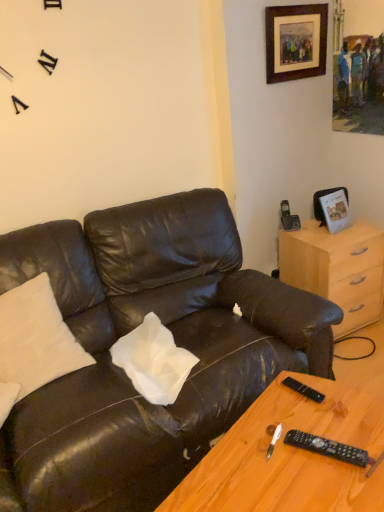
Question: Is wooden framed artwork at upper right, the second picture frame in the bottom-to-top sequence, smaller than black plastic remote at lower right, which is the first remote in top-to-bottom order?

Choices:
 (A) no
 (B) yes

Answer: (A)

Question: Would you say wooden framed artwork at upper right, the 1th picture frame in the top-to-bottom sequence, is outside black plastic remote at lower right, which is the first remote in top-to-bottom order?

Choices:
 (A) yes
 (B) no

Answer: (A)

Question: From the image's perspective, does wooden framed artwork at upper right, the second picture frame in the bottom-to-top sequence, appear lower than black plastic remote at lower right, positioned as the 2th remote in bottom-to-top order?

Choices:
 (A) yes
 (B) no

Answer: (B)

Question: Can you see wooden framed artwork at upper right, the second picture frame in the bottom-to-top sequence, touching black plastic remote at lower right, which is the second remote from front to back?

Choices:
 (A) yes
 (B) no

Answer: (B)

Question: From the image's perspective, does wooden framed artwork at upper right, the 1th picture frame in the top-to-bottom sequence, appear higher than black plastic remote at lower right, positioned as the 2th remote in bottom-to-top order?

Choices:
 (A) no
 (B) yes

Answer: (B)

Question: From a real-world perspective, is wooden framed artwork at upper right, the second picture frame in the bottom-to-top sequence, on black plastic remote at lower right, which is the first remote in top-to-bottom order?

Choices:
 (A) yes
 (B) no

Answer: (A)

Question: Is metallic silver photo frame at upper right, the first picture frame positioned from the bottom, with matte black leather couch at center?

Choices:
 (A) no
 (B) yes

Answer: (A)

Question: Is the depth of metallic silver photo frame at upper right, the first picture frame positioned from the bottom, less than that of matte black leather couch at center?

Choices:
 (A) yes
 (B) no

Answer: (B)

Question: Considering the relative sizes of metallic silver photo frame at upper right, the second picture frame in the top-to-bottom sequence, and matte black leather couch at center in the image provided, is metallic silver photo frame at upper right, the second picture frame in the top-to-bottom sequence, wider than matte black leather couch at center?

Choices:
 (A) yes
 (B) no

Answer: (B)

Question: From the image's perspective, is metallic silver photo frame at upper right, the second picture frame in the top-to-bottom sequence, above matte black leather couch at center?

Choices:
 (A) yes
 (B) no

Answer: (A)

Question: Can you confirm if metallic silver photo frame at upper right, the first picture frame positioned from the bottom, is bigger than matte black leather couch at center?

Choices:
 (A) no
 (B) yes

Answer: (A)

Question: Is metallic silver photo frame at upper right, the first picture frame positioned from the bottom, further to camera compared to matte black leather couch at center?

Choices:
 (A) no
 (B) yes

Answer: (B)

Question: Can you confirm if wooden framed artwork at upper right, the 1th picture frame in the top-to-bottom sequence, is thinner than black plastic remote at lower right, acting as the second remote starting from the back?

Choices:
 (A) no
 (B) yes

Answer: (B)